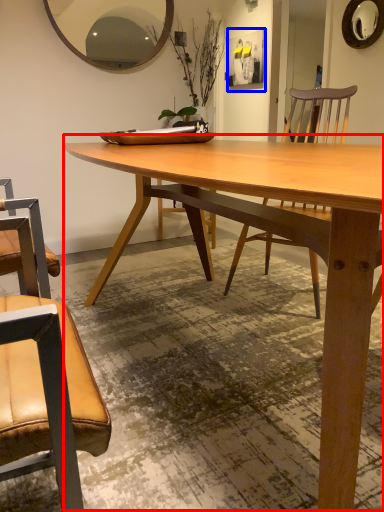
Question: Which point is closer to the camera, coffee table (highlighted by a red box) or picture frame (highlighted by a blue box)?

Choices:
 (A) coffee table
 (B) picture frame

Answer: (A)